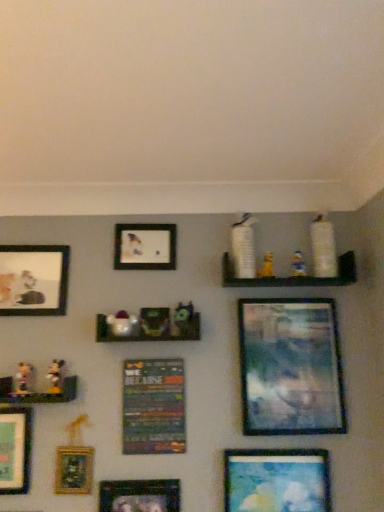
Question: Considering the positions of point (119, 505) and point (72, 468), is point (119, 505) closer or farther from the camera than point (72, 468)?

Choices:
 (A) closer
 (B) farther

Answer: (A)

Question: Is metallic silver picture frame at lower center, which is the fourth picture frame from left to right, wider or thinner than gold-framed painting at lower left, the 6th picture frame from the right?

Choices:
 (A) wide
 (B) thin

Answer: (A)

Question: Based on their relative distances, which object is nearer to the white glossy vase at upper center, which is the 5th toy in left-to-right order?

Choices:
 (A) green matte toy at center, marked as the fourth toy in a left-to-right arrangement
 (B) white matte shelf at upper center, placed as the 1th shelf when sorted from right to left
 (C) metallic poster at center, arranged as the 3th picture frame when viewed from the right
 (D) matte green picture frame at lower left, the first picture frame positioned from the left
 (E) yellow fabric toy at upper center, which is the 2th toy from right to left

Answer: (E)

Question: Which object is positioned closest to the matte paper picture frame at upper left, which appears as the 2th picture frame when viewed from the left?

Choices:
 (A) white matte toy at upper right, the 1th toy in the right-to-left sequence
 (B) metallic poster at center, arranged as the 3th picture frame when viewed from the right
 (C) matte glass picture frame at center right, placed as the 8th picture frame when sorted from left to right
 (D) matte green picture frame at lower left, the 8th picture frame from the right
 (E) shiny metallic mickey mouse at lower left, which is the 2th toy in left-to-right order

Answer: (E)